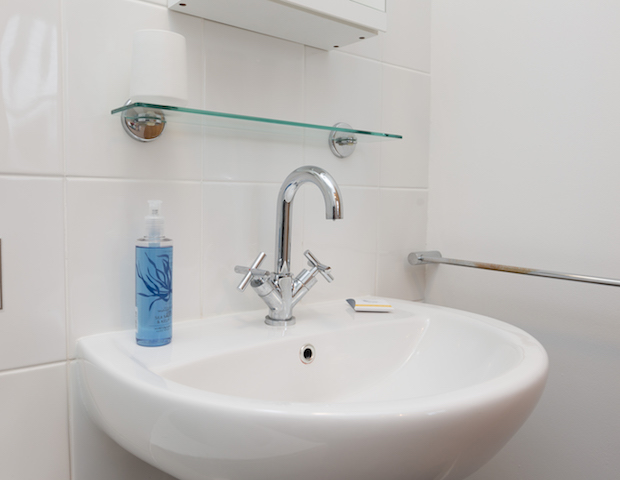
The width and height of the screenshot is (620, 480). Identify the location of blue soap. (157, 310).